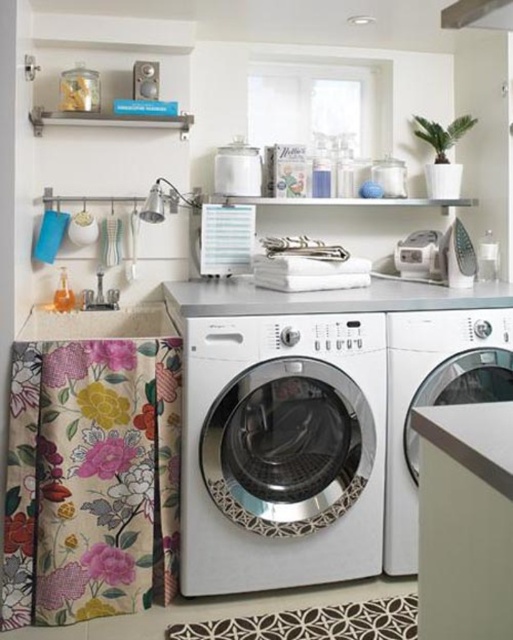
Question: Is satin silver washing machine at center closer to camera compared to satin white washing machine at center?

Choices:
 (A) yes
 (B) no

Answer: (A)

Question: Does floral fabric laundry at left appear over satin white washing machine at center?

Choices:
 (A) no
 (B) yes

Answer: (A)

Question: Is satin silver washing machine at center smaller than satin white washing machine at center?

Choices:
 (A) no
 (B) yes

Answer: (A)

Question: Which of the following is the farthest from the observer?

Choices:
 (A) (241, 308)
 (B) (400, 512)

Answer: (B)

Question: Which point appears farthest from the camera in this image?

Choices:
 (A) (145, 497)
 (B) (328, 374)

Answer: (B)

Question: Which object is farther from the camera taking this photo?

Choices:
 (A) floral fabric laundry at left
 (B) satin white washing machine at center

Answer: (B)